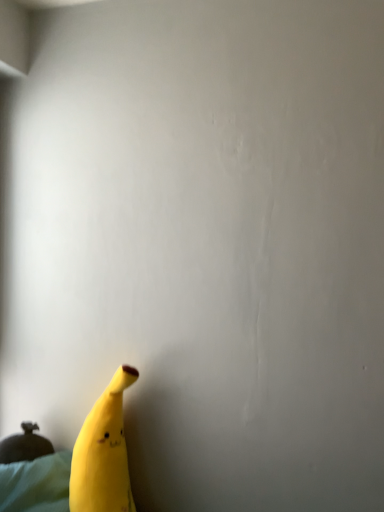
Question: Is matte green sheet at lower left taller than yellow matte banana at lower left?

Choices:
 (A) yes
 (B) no

Answer: (B)

Question: Is matte green sheet at lower left facing away from yellow matte banana at lower left?

Choices:
 (A) yes
 (B) no

Answer: (B)

Question: Is matte green sheet at lower left positioned before yellow matte banana at lower left?

Choices:
 (A) no
 (B) yes

Answer: (A)

Question: Would you consider matte green sheet at lower left to be distant from yellow matte banana at lower left?

Choices:
 (A) no
 (B) yes

Answer: (A)

Question: Could you tell me if matte green sheet at lower left is turned towards yellow matte banana at lower left?

Choices:
 (A) no
 (B) yes

Answer: (B)

Question: From a real-world perspective, is matte green sheet at lower left under yellow matte banana at lower left?

Choices:
 (A) yes
 (B) no

Answer: (A)

Question: Does yellow matte banana at lower left appear on the right side of matte green sheet at lower left?

Choices:
 (A) no
 (B) yes

Answer: (B)

Question: From the image's perspective, is yellow matte banana at lower left located beneath matte green sheet at lower left?

Choices:
 (A) no
 (B) yes

Answer: (A)

Question: From the image's perspective, is yellow matte banana at lower left over matte green sheet at lower left?

Choices:
 (A) yes
 (B) no

Answer: (A)

Question: Is yellow matte banana at lower left positioned with its back to matte green sheet at lower left?

Choices:
 (A) no
 (B) yes

Answer: (A)

Question: Is yellow matte banana at lower left not within matte green sheet at lower left?

Choices:
 (A) no
 (B) yes

Answer: (B)

Question: Does yellow matte banana at lower left appear on the left side of matte green sheet at lower left?

Choices:
 (A) no
 (B) yes

Answer: (A)

Question: Do you think yellow matte banana at lower left is within matte green sheet at lower left, or outside of it?

Choices:
 (A) inside
 (B) outside

Answer: (B)